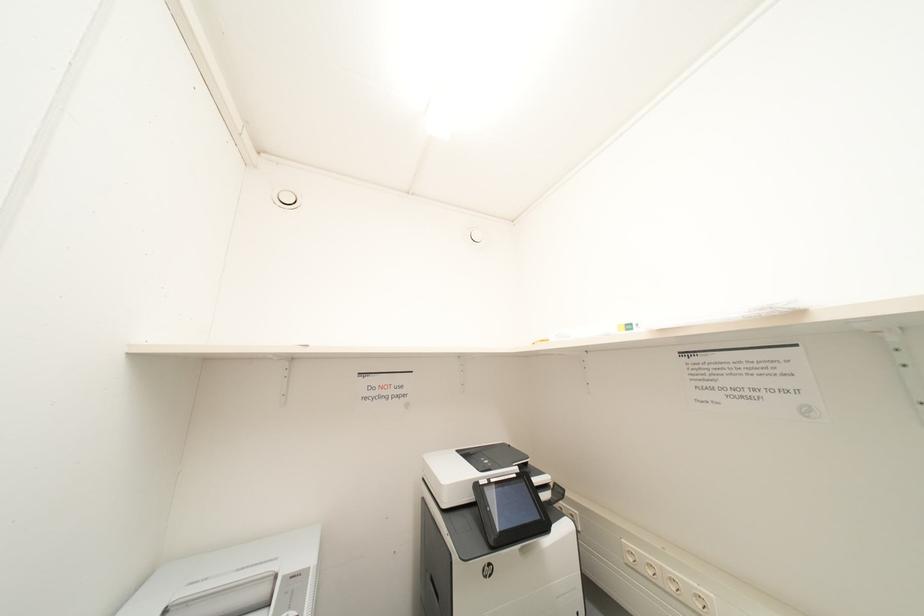
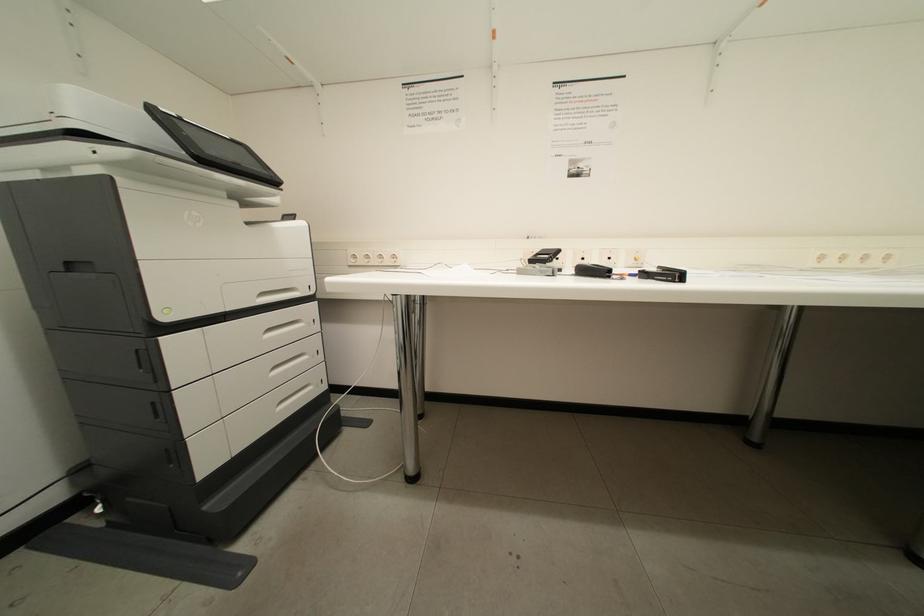
The first image is from the beginning of the video and the second image is from the end. How did the camera likely rotate when shooting the video?

The camera rotated toward right-down.